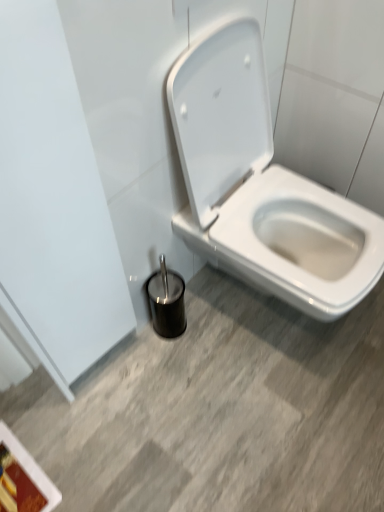
Where is `white glossy toilet at center`? The width and height of the screenshot is (384, 512). white glossy toilet at center is located at coordinates (261, 186).

Describe the element at coordinates (261, 186) in the screenshot. I see `white glossy toilet at center` at that location.

Image resolution: width=384 pixels, height=512 pixels. What are the coordinates of `white glossy toilet at center` in the screenshot? It's located at (261, 186).